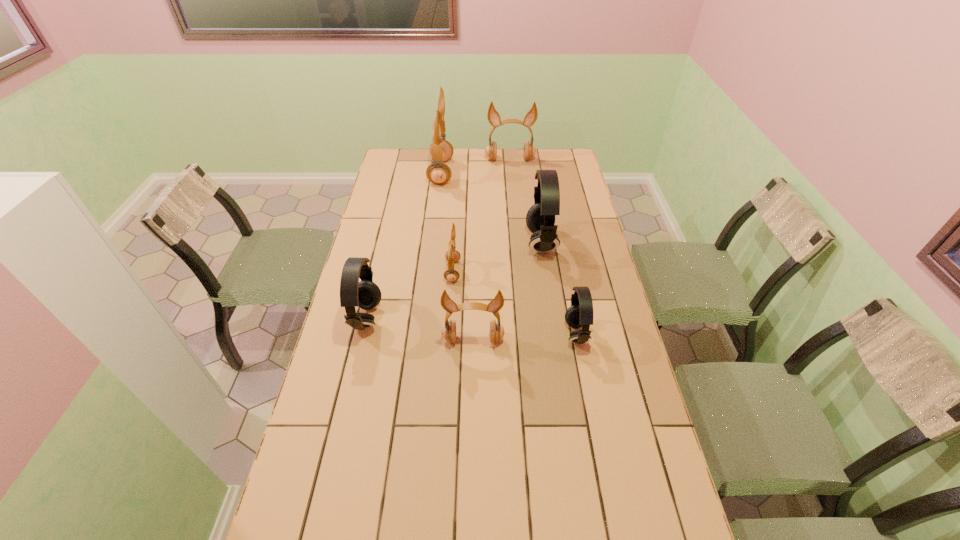
This screenshot has width=960, height=540. I want to click on black earphone that stands as the second closest to the leftmost earphone, so click(x=580, y=314).